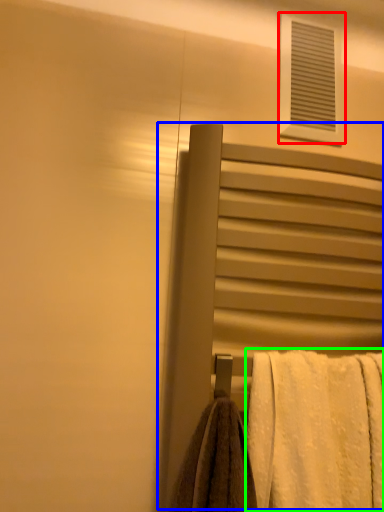
Question: Considering the real-world distances, which object is closest to window (highlighted by a red box)? screen door (highlighted by a blue box) or towel (highlighted by a green box).

Choices:
 (A) screen door
 (B) towel

Answer: (A)